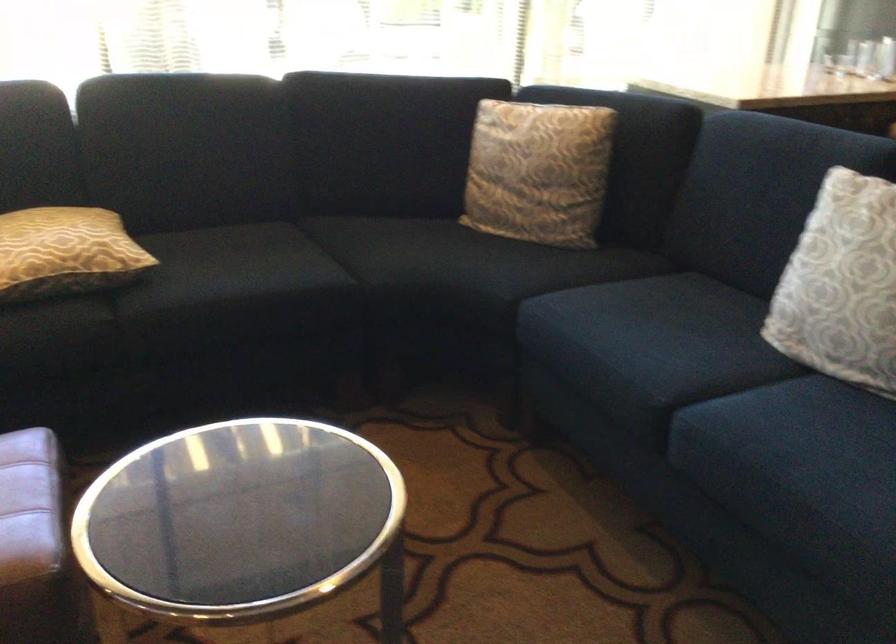
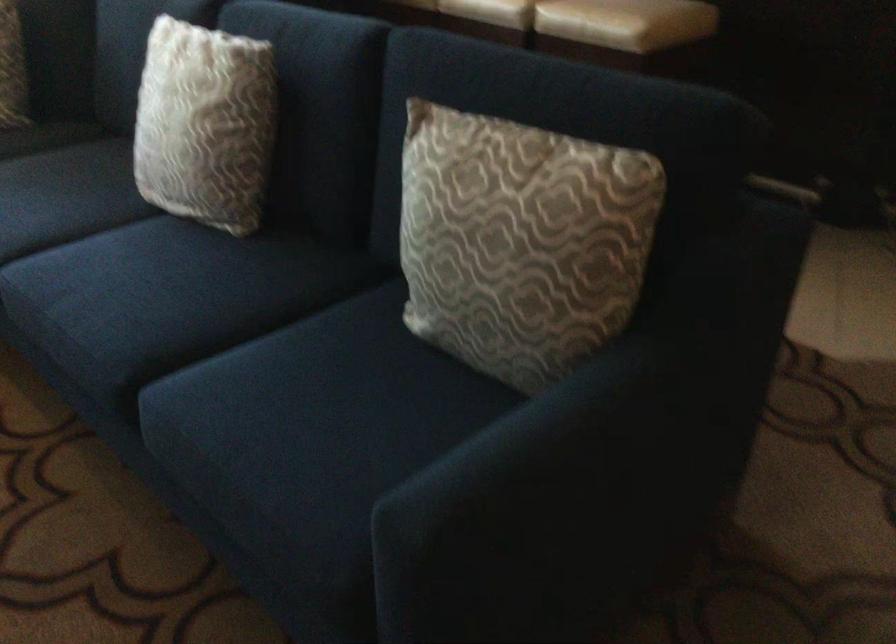
In a continuous first-person perspective shot, in which direction is the camera moving?

The cameraman walked toward right, backward.